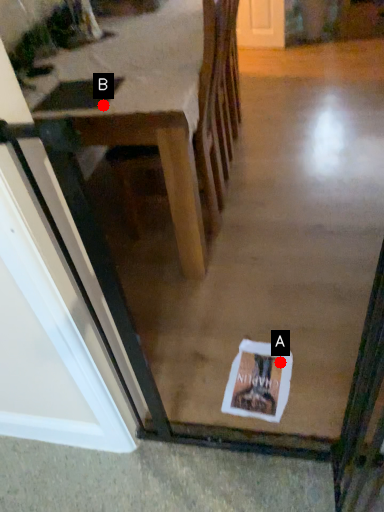
Question: Two points are circled on the image, labeled by A and B beside each circle. Which point appears farthest from the camera in this image?

Choices:
 (A) A is further
 (B) B is further

Answer: (A)